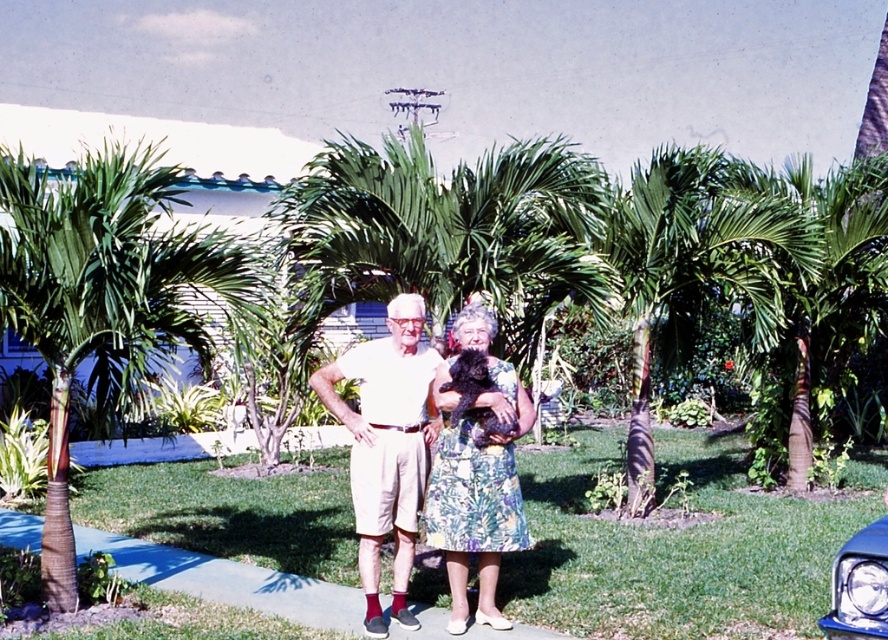
Question: Estimate the real-world distances between objects in this image. Which object is closer to the floral dress at center?

Choices:
 (A) green leafy palm tree at left
 (B) white cotton shorts at center
 (C) blue glossy car at lower right
 (D) green leafy palm tree at center-right

Answer: (B)

Question: Which of these objects is positioned closest to the blue glossy car at lower right?

Choices:
 (A) white cotton shorts at center
 (B) floral dress at center
 (C) green leafy palm tree at center-right
 (D) green leafy palm tree at left

Answer: (B)

Question: Is green leafy palm tree at left wider than green leafy palm tree at center-right?

Choices:
 (A) no
 (B) yes

Answer: (B)

Question: Does green leafy palm tree at center-right appear on the right side of floral dress at center?

Choices:
 (A) yes
 (B) no

Answer: (A)

Question: Estimate the real-world distances between objects in this image. Which object is closer to the floral dress at center?

Choices:
 (A) green leafy palm tree at center-right
 (B) green leafy palm tree at left
 (C) white cotton shorts at center

Answer: (C)

Question: In this image, where is green leafy palm tree at left located relative to blue glossy car at lower right?

Choices:
 (A) right
 (B) left

Answer: (B)